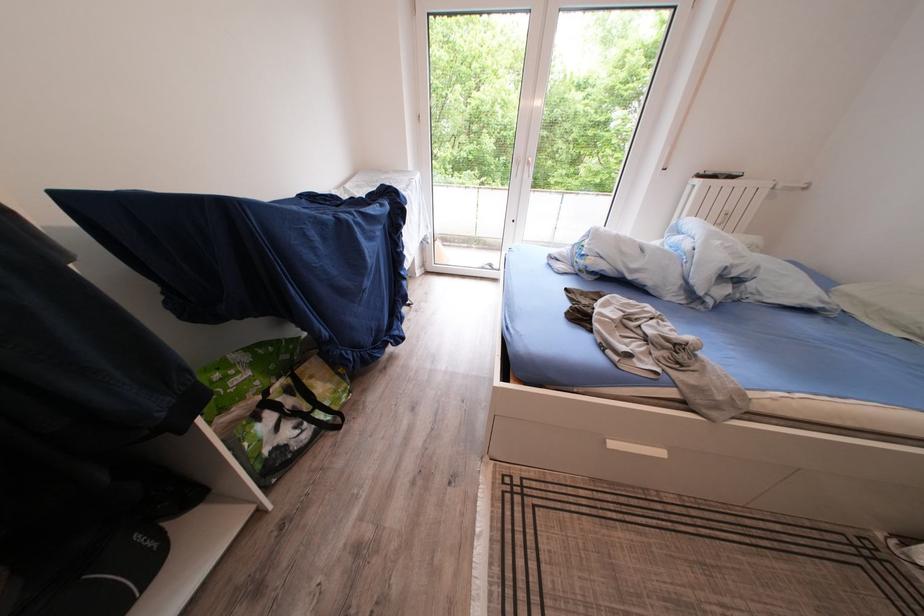
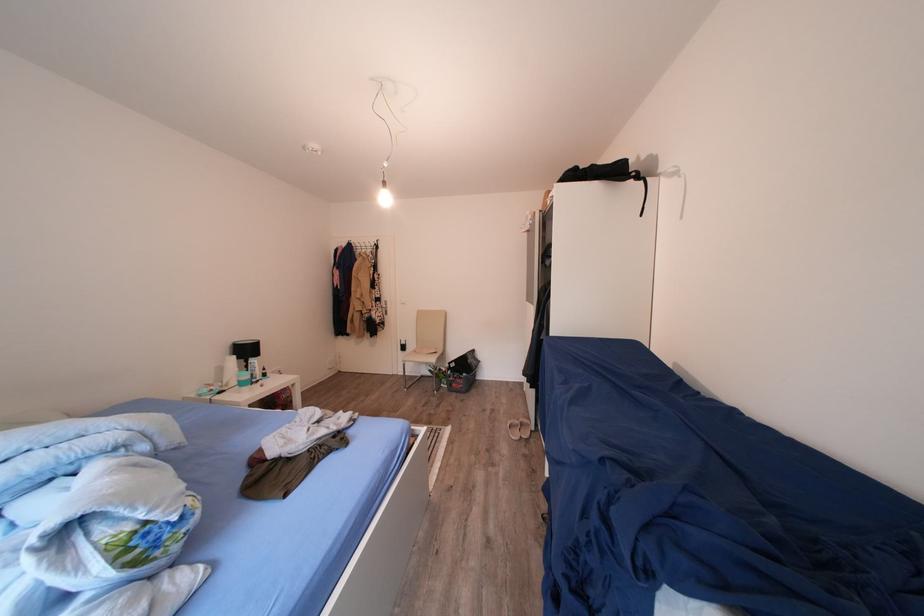
Where in the second image is the point corresponding to point 591,251 from the first image?

(142, 538)